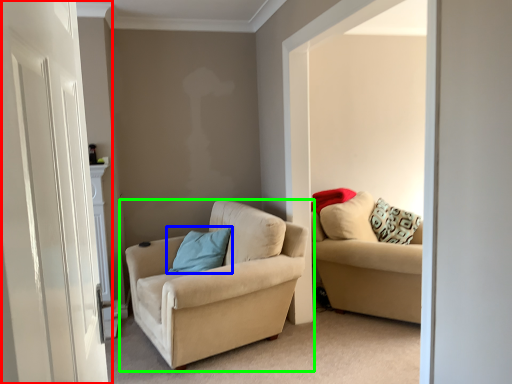
Question: Which object is the closest to the door (highlighted by a red box)? Choose among these: pillow (highlighted by a blue box) or studio couch (highlighted by a green box).

Choices:
 (A) pillow
 (B) studio couch

Answer: (B)